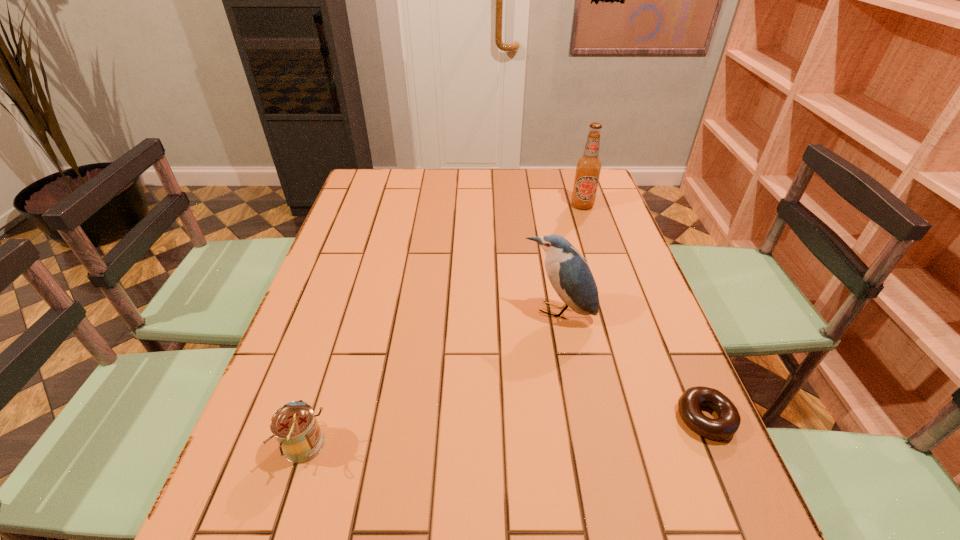
Where is `free space between the tallest object and the shortest object`? free space between the tallest object and the shortest object is located at coordinates (644, 312).

Where is `vacant point located between the tallest object and the third tallest object`? The height and width of the screenshot is (540, 960). vacant point located between the tallest object and the third tallest object is located at coordinates (444, 326).

Locate an element on the screen. The width and height of the screenshot is (960, 540). empty location between the third tallest object and the third nearest object is located at coordinates (433, 380).

Image resolution: width=960 pixels, height=540 pixels. I want to click on free space between the rightmost object and the third nearest object, so click(632, 366).

Locate an element on the screen. vacant space that's between the third nearest object and the leftmost object is located at coordinates (x=433, y=380).

Locate an element on the screen. This screenshot has width=960, height=540. free point between the leftmost object and the shortest object is located at coordinates (506, 432).

You are a GUI agent. You are given a task and a screenshot of the screen. Output one action in this format:
    pyautogui.click(x=<x>, y=<y>)
    Task: Click on the third closest object to the can
    
    Given the screenshot: What is the action you would take?
    pyautogui.click(x=588, y=167)

This screenshot has width=960, height=540. In order to click on object that can be found as the third closest to the third shortest object in this screenshot , I will do `click(294, 425)`.

At what (x,y) coordinates should I click in order to perform the action: click on vacant region that satisfies the following two spatial constraints: 1. on the back side of the can; 2. on the left side of the doughnut. Please return your answer as a coordinate pair (x, y). Looking at the image, I should click on (316, 418).

Where is `vacant space that satisfies the following two spatial constraints: 1. on the front side of the tallest object; 2. on the right side of the doughnut`? vacant space that satisfies the following two spatial constraints: 1. on the front side of the tallest object; 2. on the right side of the doughnut is located at coordinates (652, 418).